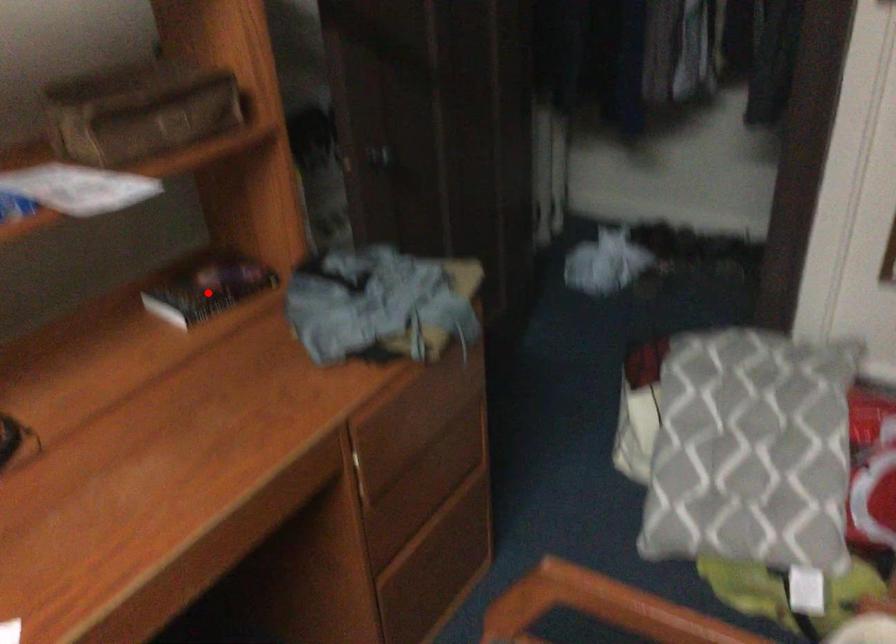
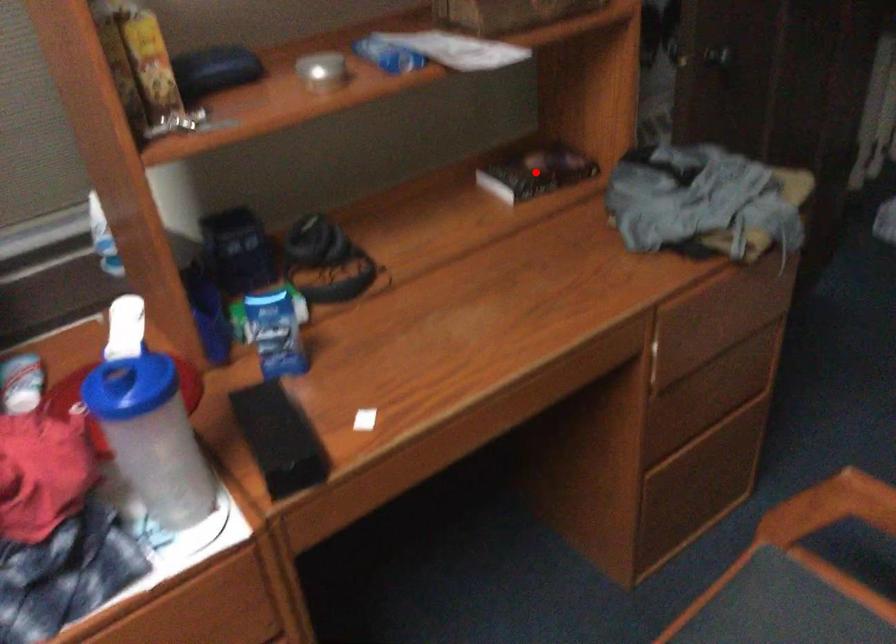
I am providing you with two images of the same scene from different viewpoints. A red point is marked on the first image and another point is marked on the second image. Is the red point in image1 aligned with the point shown in image2?

Yes